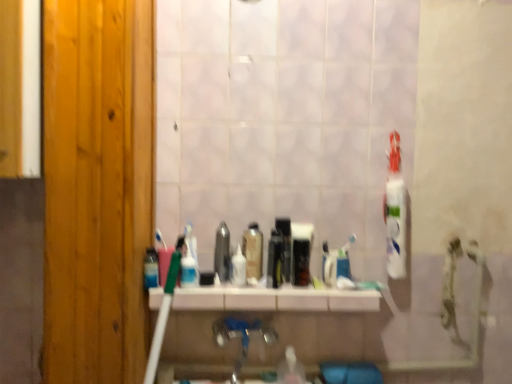
Question: Would you say white glossy shelf at center is part of white plastic toothbrush at center's contents?

Choices:
 (A) no
 (B) yes

Answer: (A)

Question: Can you confirm if white plastic toothbrush at center is taller than white glossy shelf at center?

Choices:
 (A) yes
 (B) no

Answer: (A)

Question: From the image's perspective, is white plastic toothbrush at center located beneath white glossy shelf at center?

Choices:
 (A) yes
 (B) no

Answer: (B)

Question: Are white plastic toothbrush at center and white glossy shelf at center located far from each other?

Choices:
 (A) yes
 (B) no

Answer: (B)

Question: Is white plastic toothbrush at center not within white glossy shelf at center?

Choices:
 (A) yes
 (B) no

Answer: (A)

Question: Is white plastic toothbrush at center further to camera compared to white glossy shelf at center?

Choices:
 (A) yes
 (B) no

Answer: (A)

Question: Is white plastic toothbrush at center bigger than wooden door at left?

Choices:
 (A) yes
 (B) no

Answer: (B)

Question: Considering the relative sizes of white plastic toothbrush at center and wooden door at left in the image provided, is white plastic toothbrush at center taller than wooden door at left?

Choices:
 (A) no
 (B) yes

Answer: (A)

Question: From a real-world perspective, does white plastic toothbrush at center stand above wooden door at left?

Choices:
 (A) no
 (B) yes

Answer: (A)

Question: Is white plastic toothbrush at center behind wooden door at left?

Choices:
 (A) no
 (B) yes

Answer: (B)

Question: Is white plastic toothbrush at center positioned beyond the bounds of wooden door at left?

Choices:
 (A) yes
 (B) no

Answer: (A)

Question: Is white plastic toothbrush at center far away from wooden door at left?

Choices:
 (A) no
 (B) yes

Answer: (A)

Question: Is translucent plastic mouthwash at center, positioned as the seventh mouthwash in right-to-left order, further to the viewer compared to black glossy mouthwash at center, acting as the 8th mouthwash starting from the left?

Choices:
 (A) yes
 (B) no

Answer: (B)